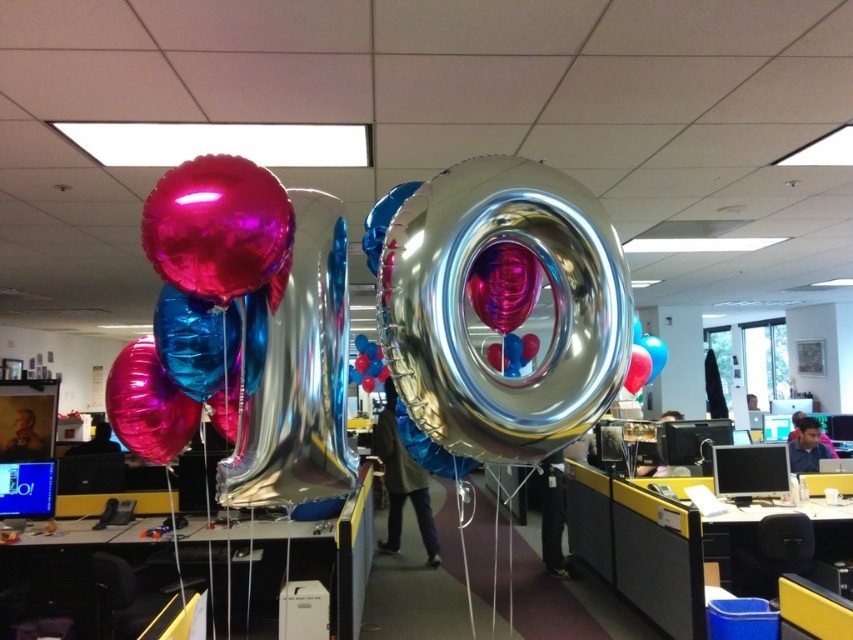
Question: Can you confirm if metallic silver balloon at center is wider than shiny metallic balloons at center?

Choices:
 (A) yes
 (B) no

Answer: (B)

Question: Can you confirm if glossy metallic balloon at center is positioned below shiny metallic balloons at center?

Choices:
 (A) no
 (B) yes

Answer: (A)

Question: Which point is closer to the camera?

Choices:
 (A) metallic silver balloon at center
 (B) shiny metallic balloons at center
 (C) silver metallic balloon at center

Answer: (A)

Question: Which point is farther to the camera?

Choices:
 (A) (143, 406)
 (B) (606, 321)
 (C) (370, 353)

Answer: (C)

Question: Is glossy metallic balloon at center to the left of silver metallic balloon at center from the viewer's perspective?

Choices:
 (A) yes
 (B) no

Answer: (B)

Question: Which point is farther to the camera?

Choices:
 (A) glossy metallic balloon at center
 (B) shiny metallic balloons at center
 (C) shiny metallic balloon at center

Answer: (B)